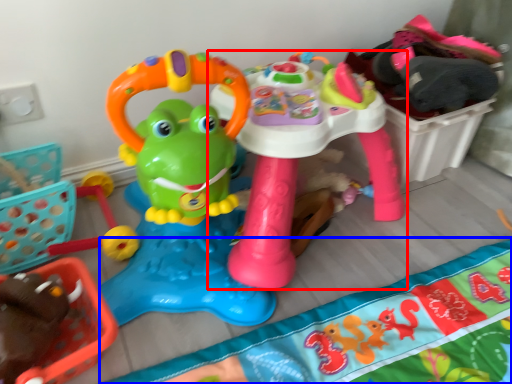
Question: Which object appears farthest to the camera in this image, toy (highlighted by a red box) or blanket (highlighted by a blue box)?

Choices:
 (A) toy
 (B) blanket

Answer: (A)